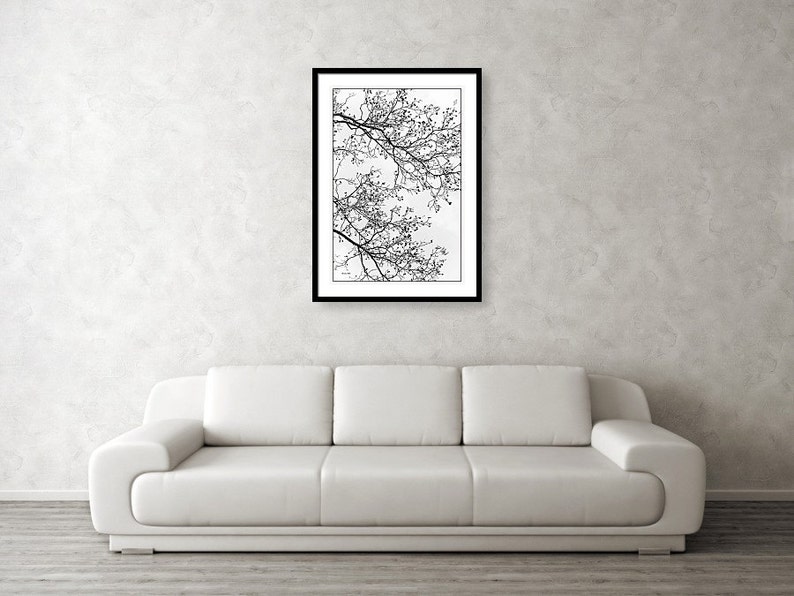
Identify the location of couch arm rest. (152, 431), (631, 434).